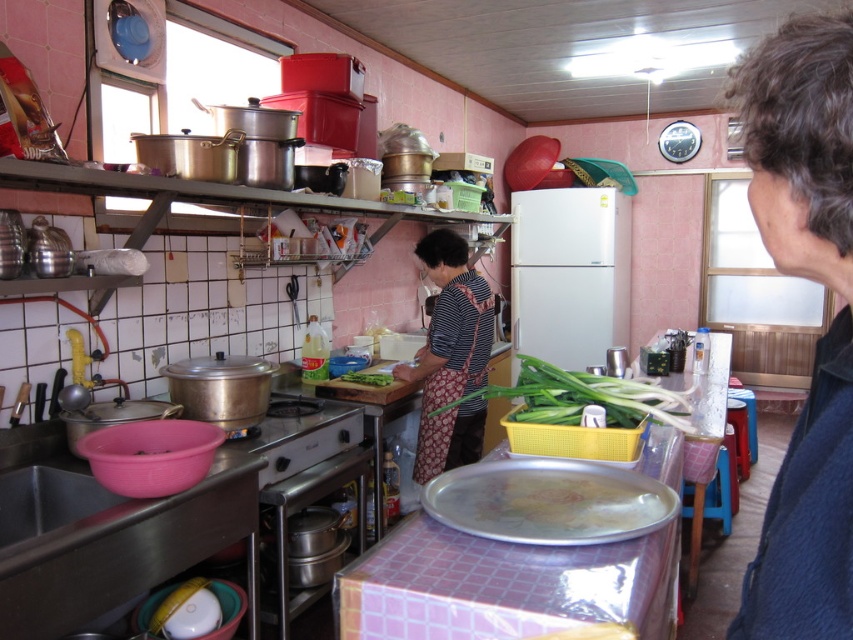
You are a delivery person holding a metallic silver tray at center that needs to be placed on a shelf 3.5 feet away. Can you reach the shelf from your current position without moving closer?

The metallic silver tray at center is 3.29 feet from the viewer. Since the shelf is 3.5 feet away, it is slightly farther than the tray, so you cannot reach the shelf without moving closer.

Based on the photo, you are a chef preparing to place a 1.5 meter long platter on the counter. You see the metallic silver tray at center and the striped fabric apron at center. Can you fit the platter between them?

The metallic silver tray at center and the striped fabric apron at center are 1.81 meters apart. Since the platter is 1.5 meters long, it can fit between them with some space remaining.